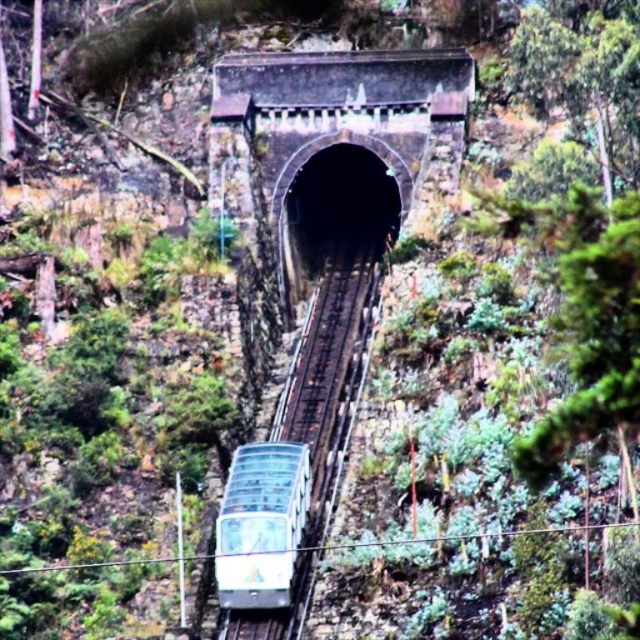
Does point (330, 268) come closer to viewer compared to point (282, 525)?

No.

Is point (316, 381) more distant than point (260, 573)?

That is True.

Between point (353, 308) and point (292, 506), which one is positioned in front?

Positioned in front is point (292, 506).

In order to click on metallic track at center in this screenshot , I will do `click(330, 365)`.